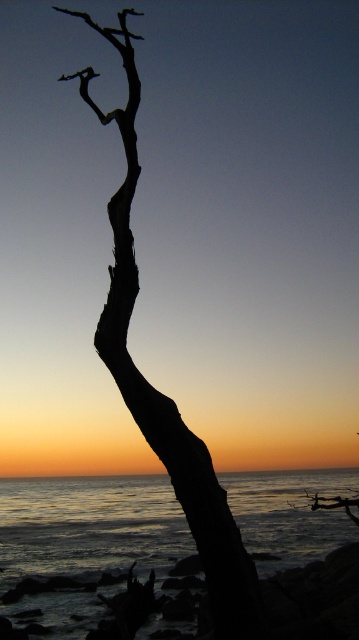
You are a photographer standing at the edge of the water. You want to capture a photo where the black matte tree at center is clearly visible in the foreground while also showing the silvery reflective water at lower center. Is this possible given their positions?

The black matte tree at center is behind the silvery reflective water at lower center, so it will appear in the background of the reflection. To have the tree in the foreground, you would need to position yourself so the tree is between you and the water. Since the tree is behind the water in the scene, this isn

You are a photographer standing at the origin point of the image coordinate system. You want to capture the reflection of the sunset in the silvery reflective water at lower center. What are the coordinates where you should aim your camera to ensure the reflection is centered in your shot?

The coordinates to aim your camera are at point (90,525) to center the reflection of the silvery reflective water at lower center.